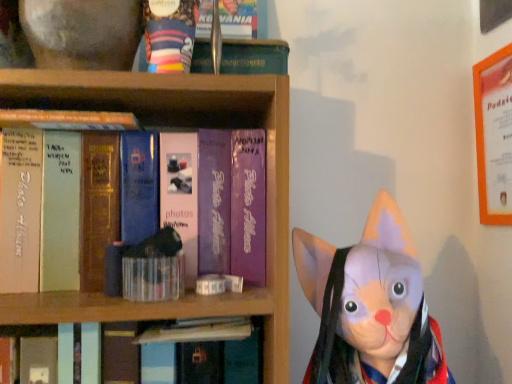
Locate an element on the screen. free space above matte blue book at upper left (from a real-world perspective) is located at coordinates (59, 116).